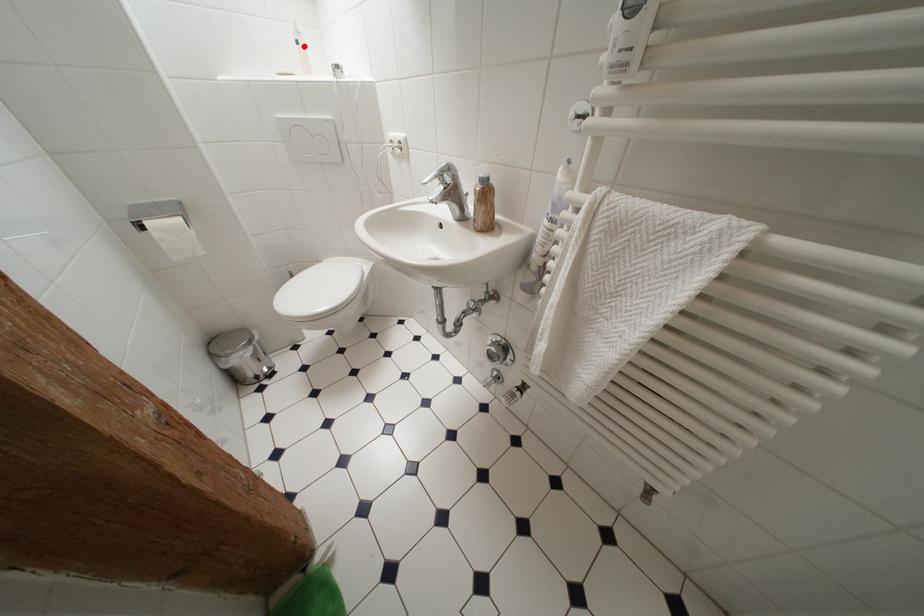
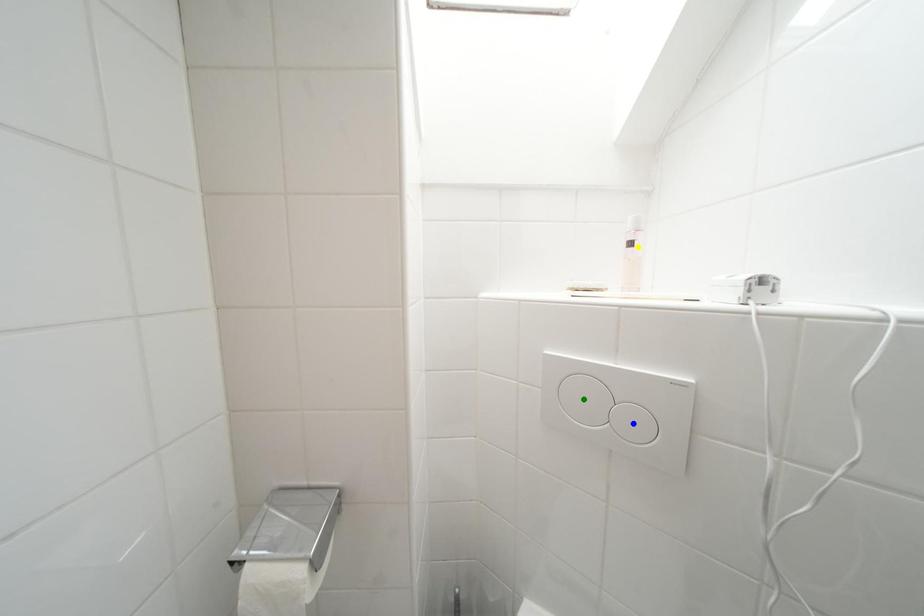
Question: I am providing you with two images of the same scene from different viewpoints. A red point is marked on the first image. You are given multiple points on the second image. Which spot in image 2 lines up with the point in image 1?

Choices:
 (A) green point
 (B) yellow point
 (C) blue point

Answer: (B)